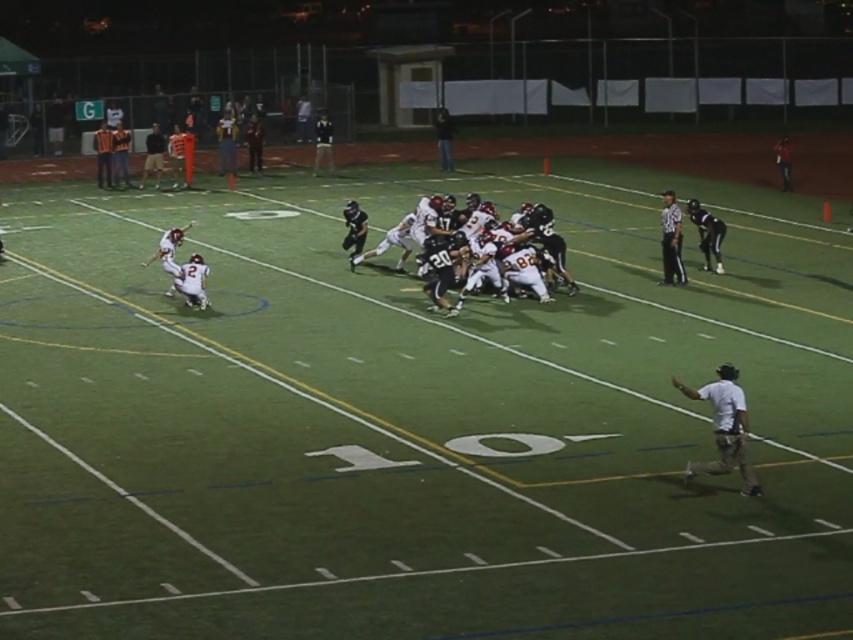
You are a spectator at the game and want to take a photo of the white cotton shirt at lower right without the white matte football players at center blocking it. Is this possible?

The white cotton shirt at lower right is behind the white matte football players at center, so it is blocked by them and cannot be photographed without obstruction.

You are a quarterback standing at the 10 yard line and you see two points on the field, point 1 at coordinates point (357, 262) and point 2 at coordinates point (717, 424). Which point is closer to you?

Point 1 at coordinates point (357, 262) is closer to you because it is further to the viewer than point 2 at coordinates point (717, 424).